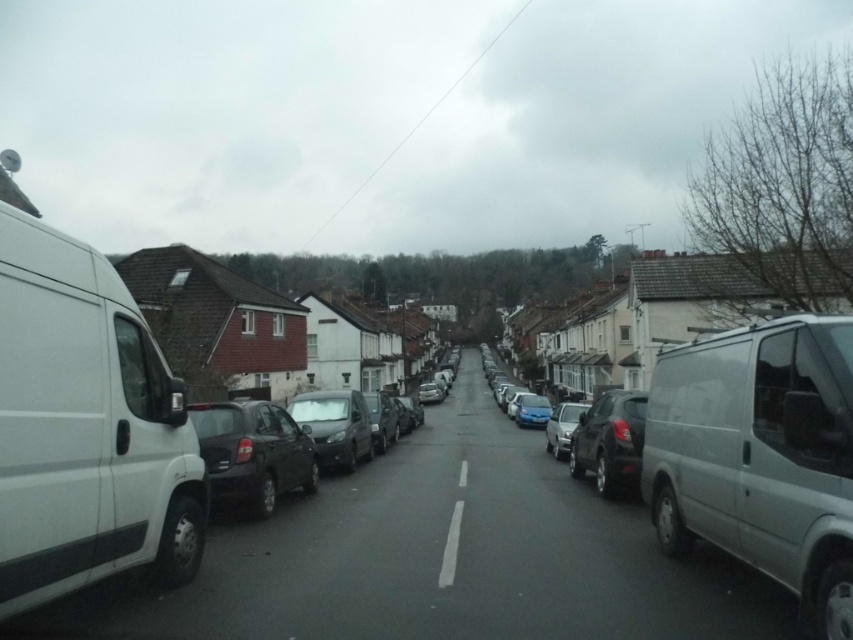
You are standing at the origin point of the image coordinate system. You want to locate the matte black car at center. What are its coordinates?

The matte black car at center is located at coordinates point (335, 426).

You are a delivery driver trying to park your truck, which is 2 meters wide, in the residential street. The parking spot you want to take is between the matte black car at center and the white solid line at center. Can your truck fit in that space?

The matte black car at center is wider than the white solid line at center. Since your truck is 2 meters wide, you need to check the available space between them. However, without knowing the exact distance between the matte black car at center and the white solid line at center, it is impossible to determine if the truck will fit. Please measure the space before attempting to park.

You are a delivery driver who needs to make a quick U turn in the residential street. The street has a white matte van at left and a white matte van at right parked on opposite sides. Can you safely perform a U turn here if your delivery van is 5 meters long?

The white matte van at left is 4.93 meters away from the white matte van at right. Since your delivery van is 5 meters long, there isn not enough space to safely perform a U turn between them.